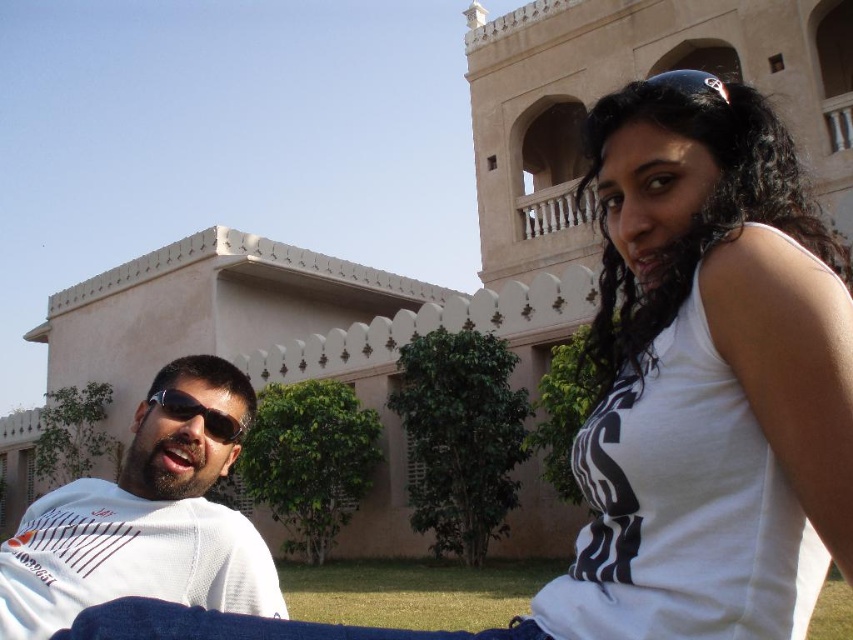
Question: Which of the following is the closest to the observer?

Choices:
 (A) matte black sunglasses at left
 (B) white fabric shirt at left

Answer: (B)

Question: Which point is farther from the camera taking this photo?

Choices:
 (A) (6, 573)
 (B) (189, 401)

Answer: (B)

Question: Among these points, which one is farthest from the camera?

Choices:
 (A) (9, 602)
 (B) (672, 595)

Answer: (A)

Question: In this image, where is white fabric shirt at left located relative to matte black sunglasses at left?

Choices:
 (A) above
 (B) below

Answer: (B)

Question: Is white fabric shirt at left behind matte black sunglasses at left?

Choices:
 (A) yes
 (B) no

Answer: (B)

Question: Is white fabric shirt at left above matte black sunglasses at left?

Choices:
 (A) yes
 (B) no

Answer: (B)